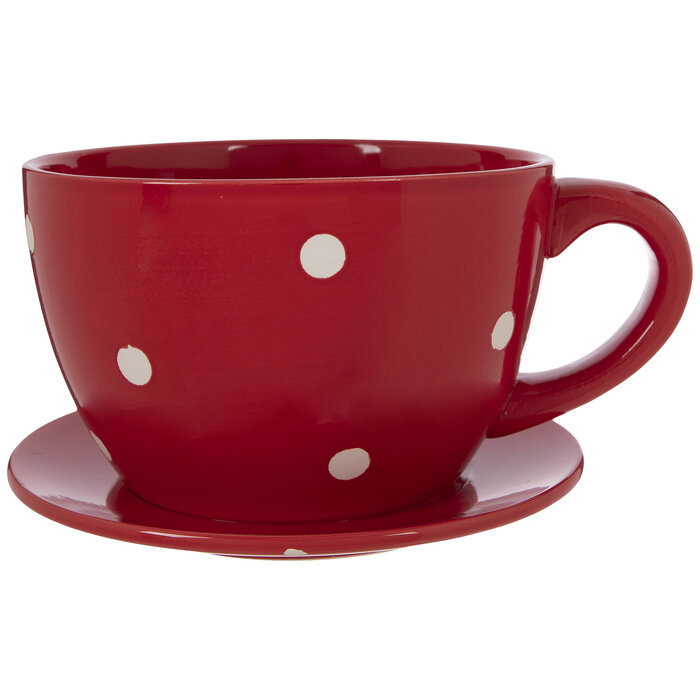
The width and height of the screenshot is (700, 700). What are the coordinates of `handle` in the screenshot? It's located at (570, 200).